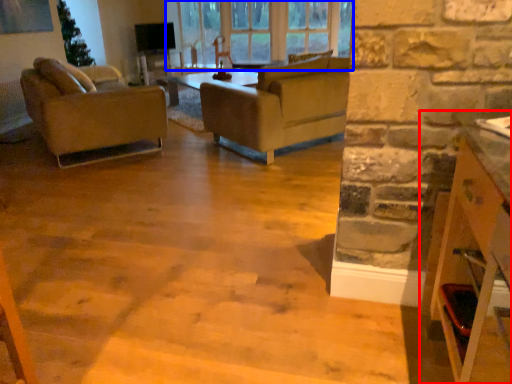
Question: Which of the following is the farthest to the observer, cabinetry (highlighted by a red box) or window (highlighted by a blue box)?

Choices:
 (A) cabinetry
 (B) window

Answer: (B)